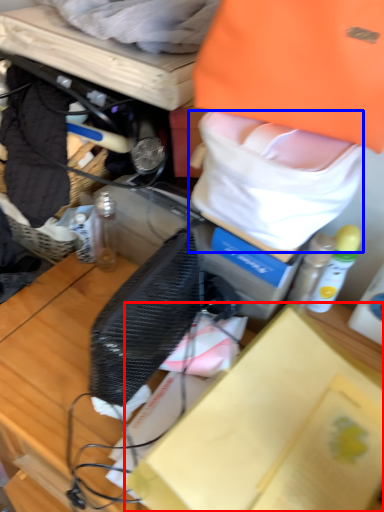
Question: Which of the following is the closest to the observer, box (highlighted by a red box) or tote bag (highlighted by a blue box)?

Choices:
 (A) box
 (B) tote bag

Answer: (A)